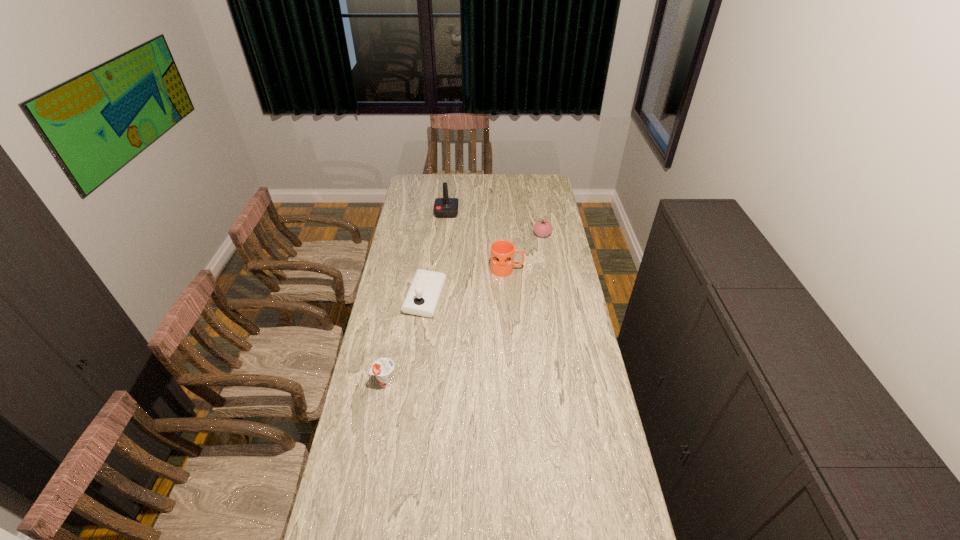
This screenshot has height=540, width=960. I want to click on the tallest object, so [x=445, y=207].

Where is `the farther joystick`? The width and height of the screenshot is (960, 540). the farther joystick is located at coordinates point(445,207).

Where is `the second object from right to left`? Image resolution: width=960 pixels, height=540 pixels. the second object from right to left is located at coordinates (502, 251).

Where is `mug`? Image resolution: width=960 pixels, height=540 pixels. mug is located at coordinates [x=502, y=251].

Identify the location of the nearer joystick. The image size is (960, 540). (422, 298).

Identify the location of the second nearest object. This screenshot has height=540, width=960. (422, 298).

The image size is (960, 540). Identify the location of the rightmost object. (542, 228).

The height and width of the screenshot is (540, 960). Identify the location of the second farthest object. (542, 228).

The image size is (960, 540). I want to click on the nearest object, so 383,368.

Find the location of a particular element. free space located 0.060m on the back of the taller joystick is located at coordinates (448, 200).